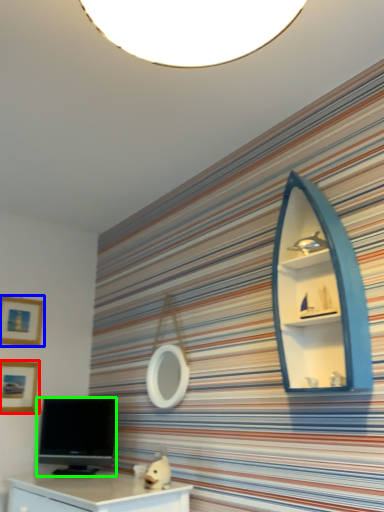
Question: Estimate the real-world distances between objects in this image. Which object is farther from picture frame (highlighted by a red box), picture frame (highlighted by a blue box) or television (highlighted by a green box)?

Choices:
 (A) picture frame
 (B) television

Answer: (B)